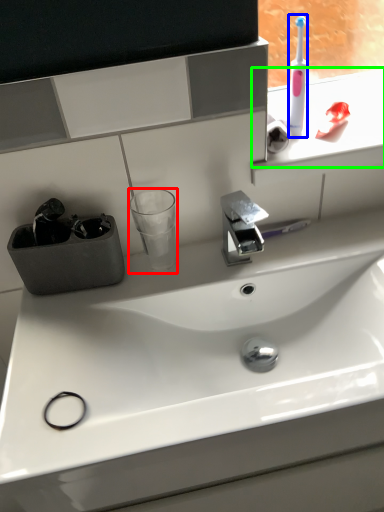
Question: Which object is positioned closest to shot glass (highlighted by a red box)? Select from toothbrush (highlighted by a blue box) and window sill (highlighted by a green box).

Choices:
 (A) toothbrush
 (B) window sill

Answer: (A)